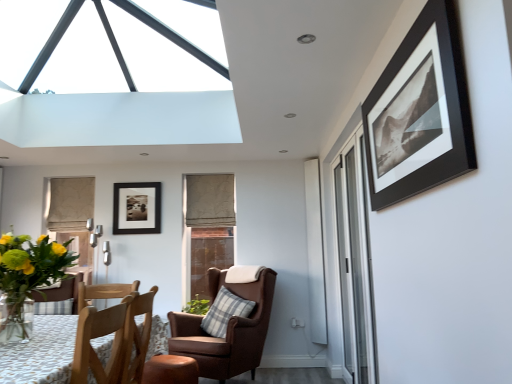
Question: Does wooden chair at lower left, positioned as the second chair in back-to-front order, have a greater height compared to green leafy plant at lower left?

Choices:
 (A) no
 (B) yes

Answer: (B)

Question: Would you say green leafy plant at lower left is part of wooden chair at lower left, which ranks as the 1th chair in front-to-back order,'s contents?

Choices:
 (A) no
 (B) yes

Answer: (A)

Question: From a real-world perspective, is wooden chair at lower left, which ranks as the 1th chair in front-to-back order, physically above green leafy plant at lower left?

Choices:
 (A) yes
 (B) no

Answer: (B)

Question: Does wooden chair at lower left, which ranks as the 1th chair in front-to-back order, have a lesser width compared to green leafy plant at lower left?

Choices:
 (A) yes
 (B) no

Answer: (B)

Question: Does wooden chair at lower left, which ranks as the 1th chair in front-to-back order, appear on the right side of green leafy plant at lower left?

Choices:
 (A) no
 (B) yes

Answer: (B)

Question: Is plaid fabric pillow at center taller or shorter than matte black picture frame at center, placed as the 2th picture frame when sorted from front to back?

Choices:
 (A) tall
 (B) short

Answer: (B)

Question: Relative to matte black picture frame at center, placed as the 2th picture frame when sorted from front to back, is plaid fabric pillow at center in front or behind?

Choices:
 (A) behind
 (B) front

Answer: (B)

Question: In terms of width, does plaid fabric pillow at center look wider or thinner when compared to matte black picture frame at center, acting as the second picture frame starting from the right?

Choices:
 (A) wide
 (B) thin

Answer: (A)

Question: Based on their positions, is plaid fabric pillow at center located to the left or right of matte black picture frame at center, the first picture frame when ordered from back to front?

Choices:
 (A) right
 (B) left

Answer: (A)

Question: Is transparent glass window at upper center, the second window from the right, taller or shorter than leather wingback chair with plaid pillow at center, which is counted as the second chair, starting from the front?

Choices:
 (A) short
 (B) tall

Answer: (A)

Question: Relative to leather wingback chair with plaid pillow at center, arranged as the 1th chair when viewed from the back, is transparent glass window at upper center, the first window from the top, in front or behind?

Choices:
 (A) behind
 (B) front

Answer: (B)

Question: Looking at their shapes, would you say transparent glass window at upper center, which appears as the second window when viewed from the back, is wider or thinner than leather wingback chair with plaid pillow at center, which is counted as the second chair, starting from the front?

Choices:
 (A) thin
 (B) wide

Answer: (B)

Question: Considering the relative positions of transparent glass window at upper center, the second window from the right, and leather wingback chair with plaid pillow at center, arranged as the 1th chair when viewed from the back, in the image provided, is transparent glass window at upper center, the second window from the right, to the left or to the right of leather wingback chair with plaid pillow at center, arranged as the 1th chair when viewed from the back,?

Choices:
 (A) left
 (B) right

Answer: (A)

Question: Considering the positions of transparent glass window at upper center, placed as the second window when sorted from bottom to top, and black matte picture frame at upper right, which is counted as the first picture frame, starting from the front, in the image, is transparent glass window at upper center, placed as the second window when sorted from bottom to top, bigger or smaller than black matte picture frame at upper right, which is counted as the first picture frame, starting from the front,?

Choices:
 (A) small
 (B) big

Answer: (B)

Question: Is transparent glass window at upper center, which appears as the second window when viewed from the back, wider or thinner than black matte picture frame at upper right, which is counted as the first picture frame, starting from the front?

Choices:
 (A) thin
 (B) wide

Answer: (B)